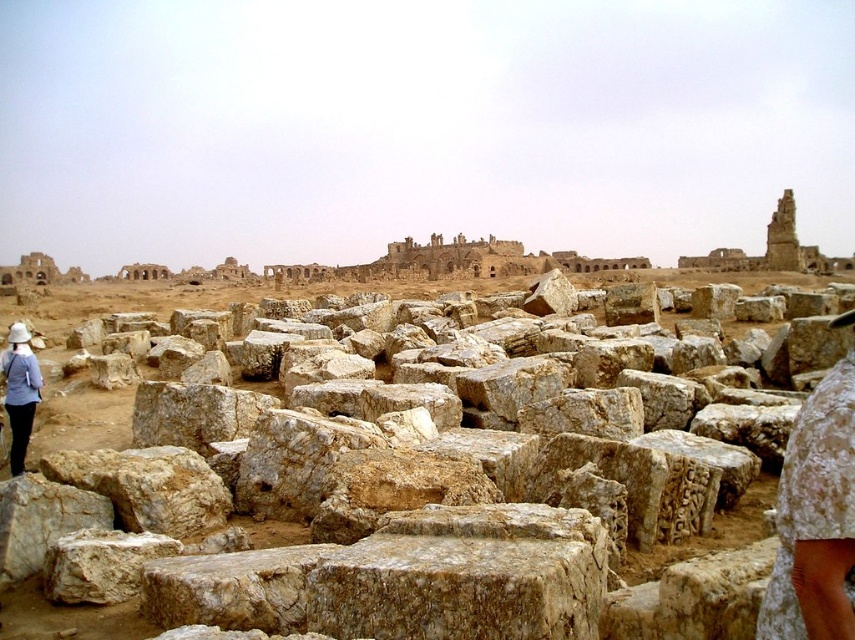
Question: Can you confirm if natural stone blocks at center is bigger than light blue fabric hat at left?

Choices:
 (A) yes
 (B) no

Answer: (A)

Question: Does natural stone blocks at center have a larger size compared to light blue fabric hat at left?

Choices:
 (A) yes
 (B) no

Answer: (A)

Question: Which of the following is the farthest from the observer?

Choices:
 (A) natural stone blocks at center
 (B) light blue fabric hat at left

Answer: (B)

Question: Is natural stone blocks at center positioned in front of light blue fabric hat at left?

Choices:
 (A) yes
 (B) no

Answer: (A)